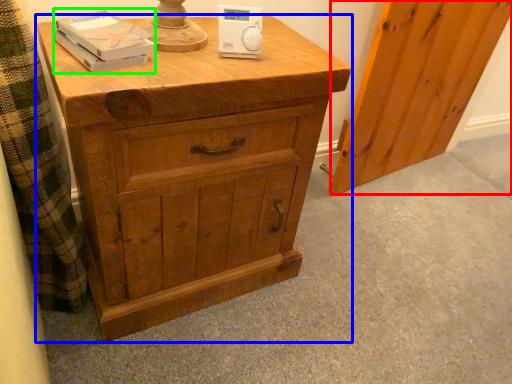
Question: Which object is the closest to the screen door (highlighted by a red box)? Choose among these: chest of drawers (highlighted by a blue box) or book (highlighted by a green box).

Choices:
 (A) chest of drawers
 (B) book

Answer: (A)